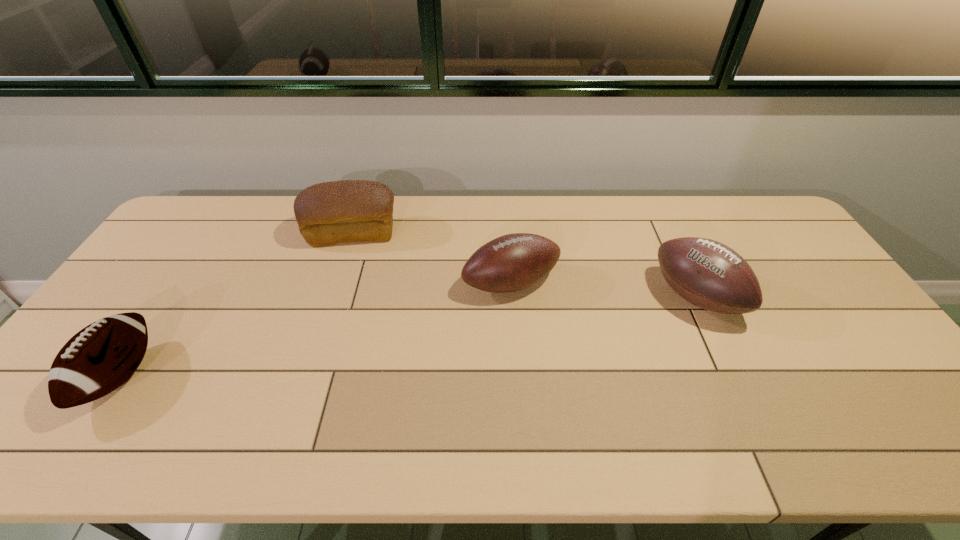
Identify which football (American) is located as the nearest to the leftmost football (American). Please provide its 2D coordinates. Your answer should be formatted as a tuple, i.e. [(x, y)], where the tuple contains the x and y coordinates of a point satisfying the conditions above.

[(513, 262)]

Find the location of a particular element. This screenshot has width=960, height=540. football (American) that is the closest to the rightmost object is located at coordinates tap(513, 262).

Locate an element on the screen. The width and height of the screenshot is (960, 540). vacant space that satisfies the following two spatial constraints: 1. on the back side of the leftmost football (American); 2. on the right side of the rightmost object is located at coordinates (173, 298).

The width and height of the screenshot is (960, 540). Find the location of `vacant space that satisfies the following two spatial constraints: 1. on the back side of the leftmost object; 2. on the left side of the second object from left to right`. vacant space that satisfies the following two spatial constraints: 1. on the back side of the leftmost object; 2. on the left side of the second object from left to right is located at coordinates (216, 233).